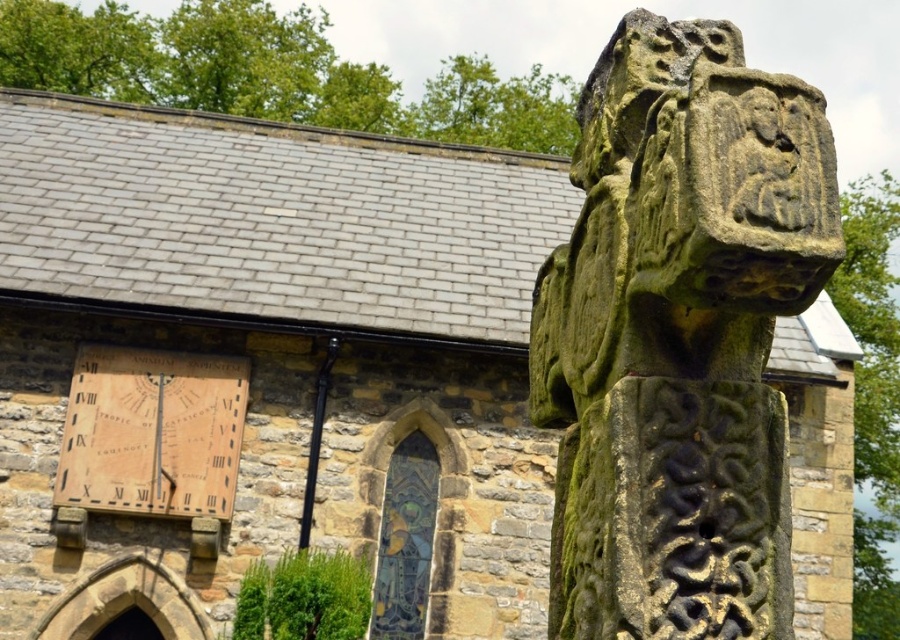
Does green mossy stone cross at upper right lie behind wooden sundial at left?

No.

Is green mossy stone cross at upper right shorter than wooden sundial at left?

No.

Locate an element on the screen. The width and height of the screenshot is (900, 640). green mossy stone cross at upper right is located at coordinates coord(678,337).